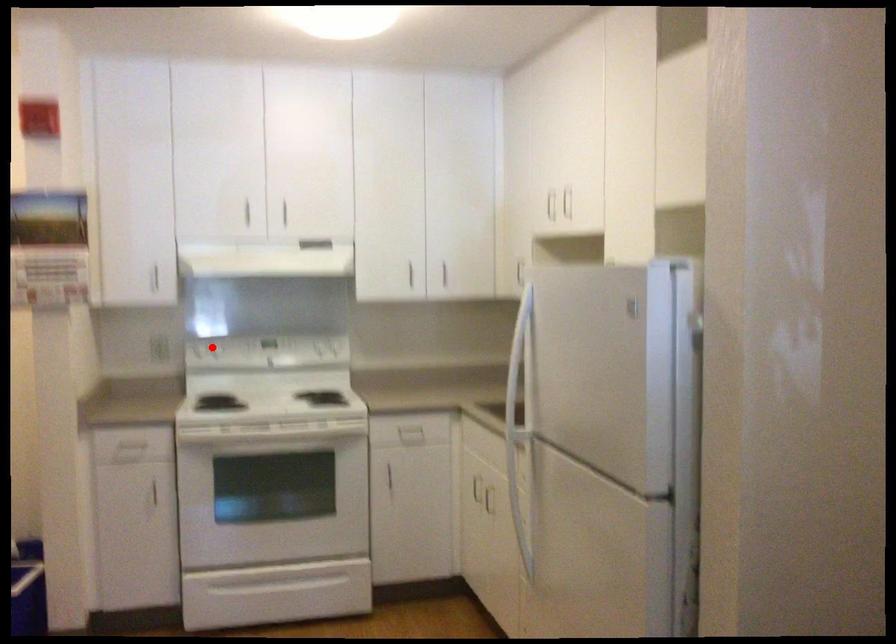
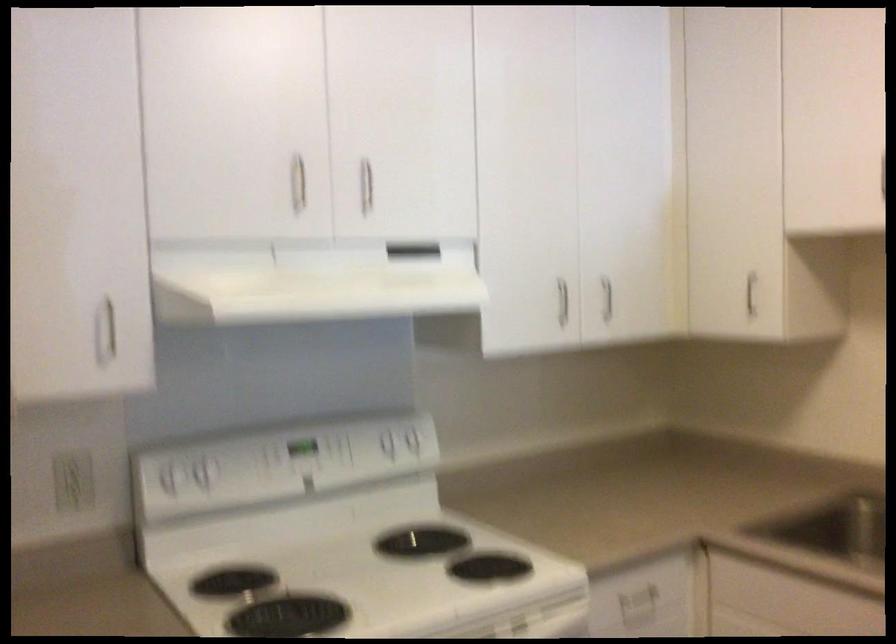
Question: I am providing you with two images of the same scene from different viewpoints. A red point is marked on the first image. Is the red point's position out of view in image 2?

Choices:
 (A) Yes
 (B) No

Answer: (B)